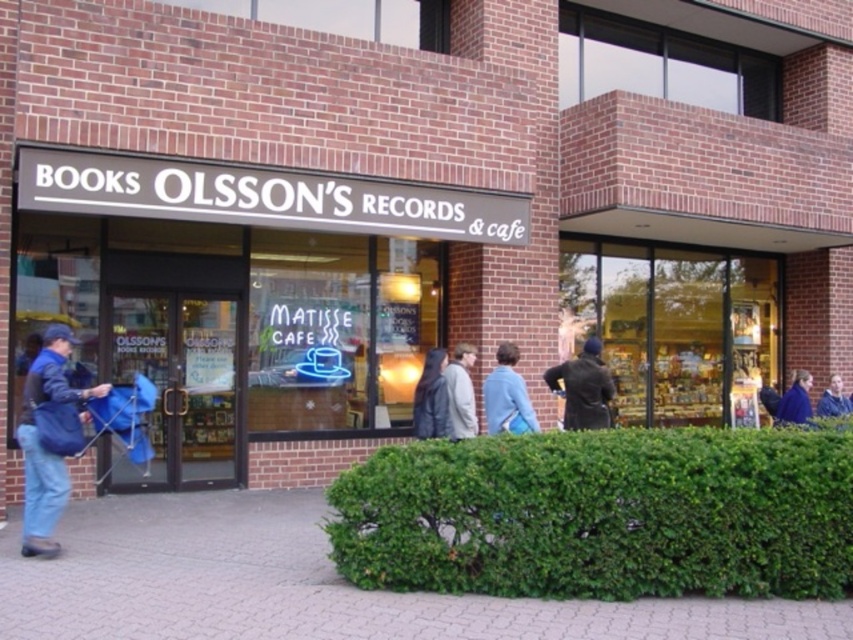
Question: Does blue cotton jacket at center appear on the right side of dark blue leather jacket at center?

Choices:
 (A) no
 (B) yes

Answer: (B)

Question: Which of the following is the closest to the observer?

Choices:
 (A) (44, 452)
 (B) (515, 429)
 (C) (457, 385)
 (D) (590, 483)

Answer: (D)

Question: Is green leafy hedge at lower center thinner than blue cotton jacket at center?

Choices:
 (A) yes
 (B) no

Answer: (B)

Question: Which object is closer to the camera taking this photo?

Choices:
 (A) blue fabric coat at center
 (B) blue cotton jacket at center
 (C) dark brown leather coat at center
 (D) blue fabric bag at lower left

Answer: (D)

Question: Does light gray jacket at center have a larger size compared to blue denim jacket at upper right?

Choices:
 (A) yes
 (B) no

Answer: (B)

Question: Which object is farther from the camera taking this photo?

Choices:
 (A) green leafy hedge at lower center
 (B) matte black sign at center
 (C) blue cotton jacket at center

Answer: (C)